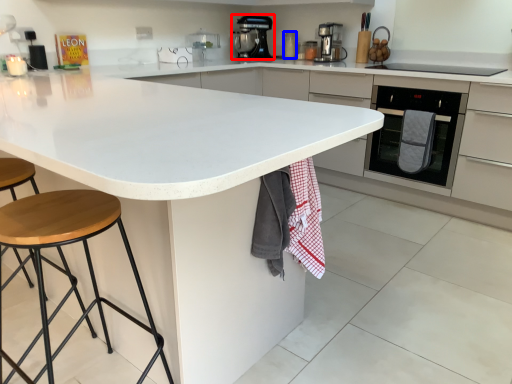
Question: Which object is closer to the camera taking this photo, kitchen appliance (highlighted by a red box) or appliance (highlighted by a blue box)?

Choices:
 (A) kitchen appliance
 (B) appliance

Answer: (A)